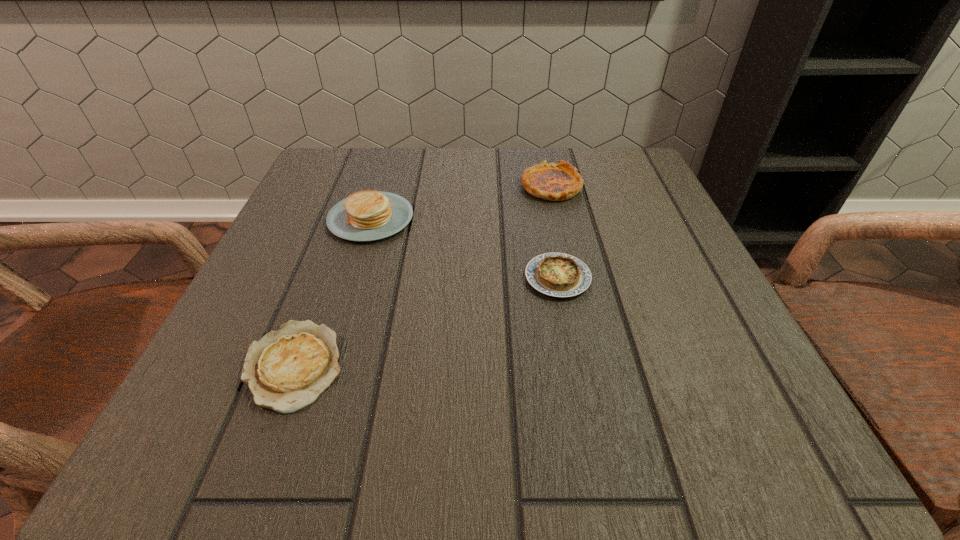
At what (x,y) coordinates should I click in order to perform the action: click on pancake. Please return your answer as a coordinate pair (x, y). Looking at the image, I should click on (369, 215).

At what (x,y) coordinates should I click in order to perform the action: click on the farthest quiche. Please return your answer as a coordinate pair (x, y). The height and width of the screenshot is (540, 960). Looking at the image, I should click on (556, 182).

The width and height of the screenshot is (960, 540). What are the coordinates of `the third shortest object` in the screenshot? It's located at (556, 182).

The image size is (960, 540). Identify the location of the second farthest quiche. (555, 274).

At what (x,y) coordinates should I click in order to perform the action: click on the shortest object. Please return your answer as a coordinate pair (x, y). Looking at the image, I should click on (286, 370).

Identify the location of the leftmost quiche. The width and height of the screenshot is (960, 540). (286, 370).

At what (x,y) coordinates should I click in order to perform the action: click on vacant space situated on the front of the tallest object. Please return your answer as a coordinate pair (x, y). This screenshot has width=960, height=540. Looking at the image, I should click on click(338, 325).

You are a GUI agent. You are given a task and a screenshot of the screen. Output one action in this format:
    pyautogui.click(x=<x>, y=<y>)
    Task: Click on the free space located on the left of the third shortest object
    
    Given the screenshot: What is the action you would take?
    pyautogui.click(x=442, y=186)

You are a GUI agent. You are given a task and a screenshot of the screen. Output one action in this format:
    pyautogui.click(x=<x>, y=<y>)
    Task: Click on the vacant space located 0.370m on the back of the third farthest object
    
    Given the screenshot: What is the action you would take?
    pyautogui.click(x=535, y=155)

Find the location of a particular element. The height and width of the screenshot is (540, 960). vacant space located 0.390m on the back of the shortest object is located at coordinates (361, 186).